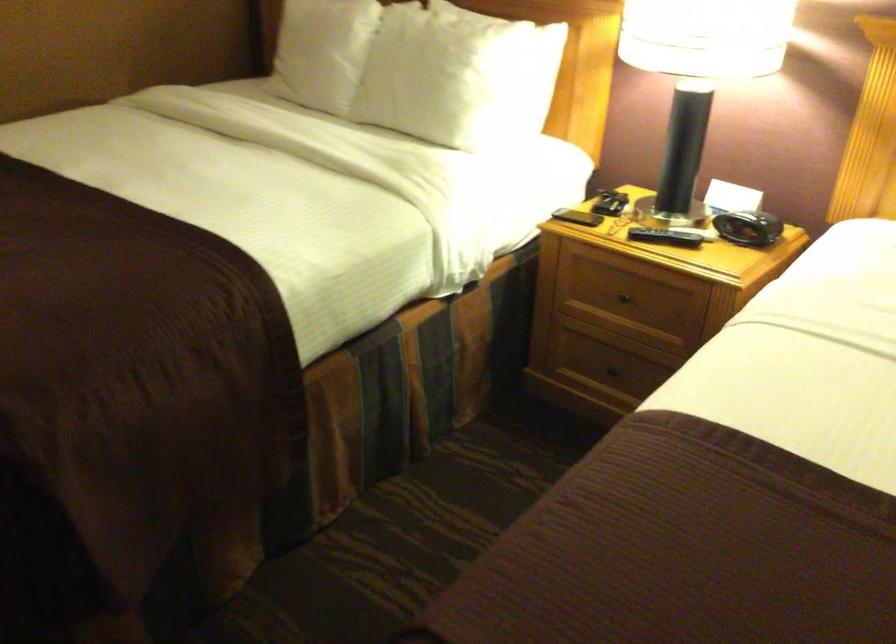
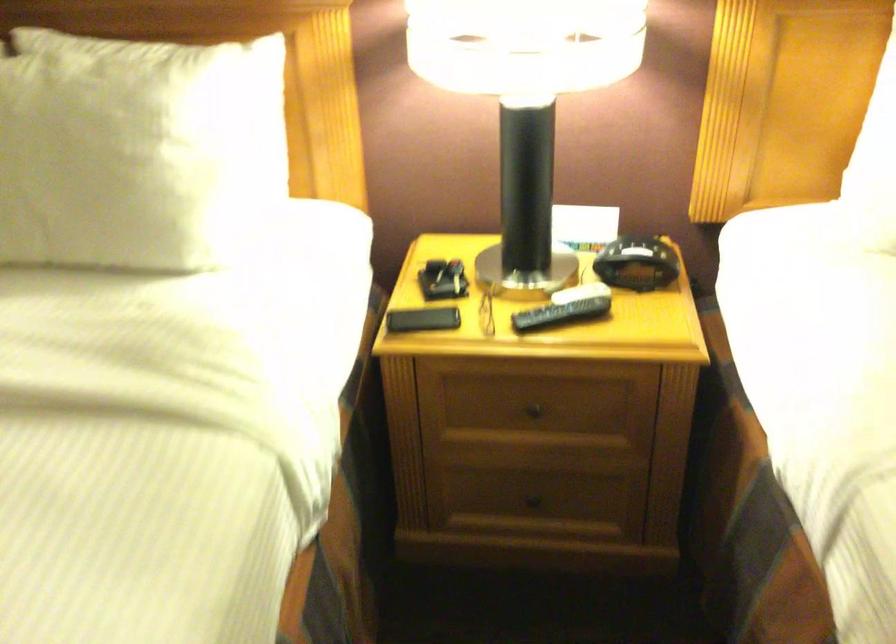
The point at (631,307) is marked in the first image. Where is the corresponding point in the second image?

(540, 413)